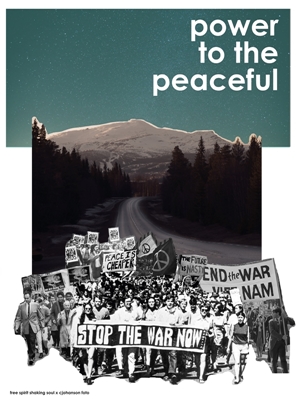
At what (x,y) coordinates should I click in order to perform the action: click on poster board. Please return your answer as a coordinate pair (x, y). This screenshot has width=296, height=400. Looking at the image, I should click on (130, 243), (112, 232), (94, 237), (78, 238), (68, 249), (75, 272), (53, 279), (117, 260), (193, 266).